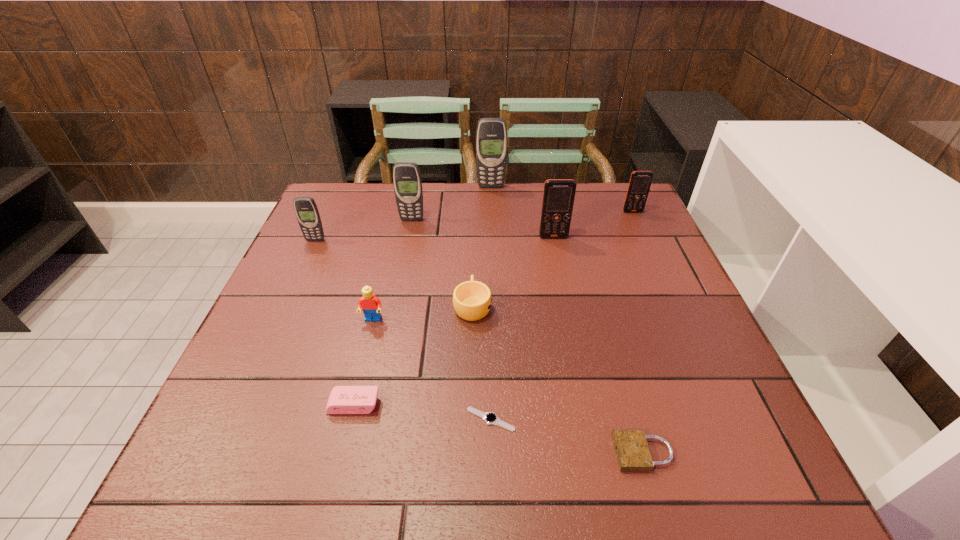
At what (x,y) coordinates should I click in order to perform the action: click on the tallest cellular telephone. Please return your answer as a coordinate pair (x, y). This screenshot has width=960, height=540. Looking at the image, I should click on (491, 135).

At what (x,y) coordinates should I click in order to perform the action: click on the tallest object. Please return your answer as a coordinate pair (x, y). The image size is (960, 540). Looking at the image, I should click on (491, 135).

Where is `the second nearest gray cellular telephone`? Image resolution: width=960 pixels, height=540 pixels. the second nearest gray cellular telephone is located at coordinates (407, 182).

Identify the location of the third farthest object. (407, 182).

I want to click on the second cellular telephone from right to left, so click(x=558, y=196).

Identify the location of the left orange cellular telephone. (558, 196).

Locate an element on the screen. The width and height of the screenshot is (960, 540). the right orange cellular telephone is located at coordinates (640, 182).

Find the location of a particular element. Image resolution: width=960 pixels, height=540 pixels. the rightmost cellular telephone is located at coordinates (640, 182).

Where is `the leftmost cellular telephone`? Image resolution: width=960 pixels, height=540 pixels. the leftmost cellular telephone is located at coordinates (306, 210).

Locate an element on the screen. The image size is (960, 540). the leftmost object is located at coordinates (306, 210).